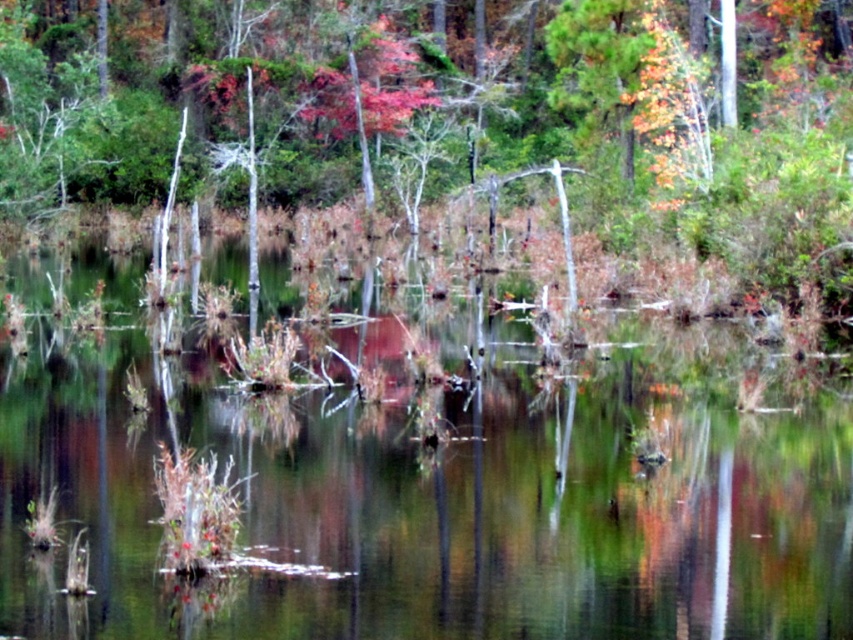
You are standing at the edge of the wetland scene and want to find the green reflective water at center. According to the coordinates provided, where exactly should you look to locate it?

The green reflective water at center is located at coordinates point (434, 506).

You are a bird flying over the wetland and want to land on the smooth bark tree at center. From your current position above the green reflective water at center, which direction should you fly to reach the tree?

The green reflective water at center is below the smooth bark tree at center, so you should fly upward to reach the tree from above the water.